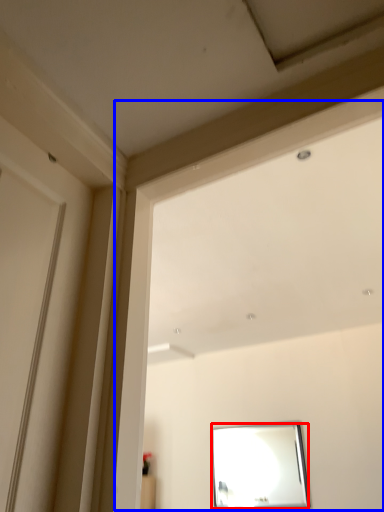
Question: Which of the following is the farthest to the observer, mirror (highlighted by a red box) or window frame (highlighted by a blue box)?

Choices:
 (A) mirror
 (B) window frame

Answer: (A)